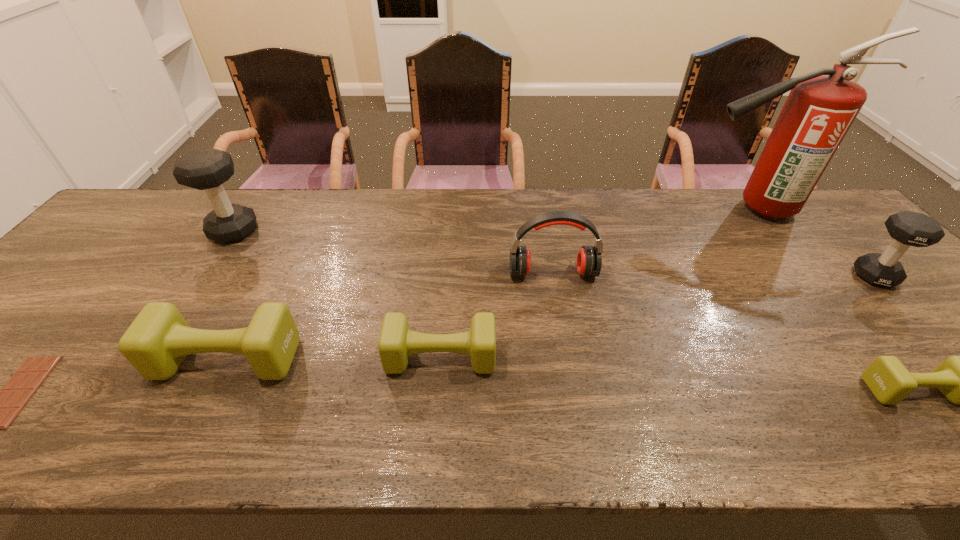
Where is `the closest olive dumbbell to the chocolate bar`? The width and height of the screenshot is (960, 540). the closest olive dumbbell to the chocolate bar is located at coordinates (156, 343).

Choose which olive dumbbell is the second nearest neighbor to the fourth dumbbell from left to right. Please provide its 2D coordinates. Your answer should be formatted as a tuple, i.e. [(x, y)], where the tuple contains the x and y coordinates of a point satisfying the conditions above.

[(156, 343)]

At what (x,y) coordinates should I click in order to perform the action: click on vacant space that satisfies the following two spatial constraints: 1. on the back side of the smaller gray dumbbell; 2. at the nozzle of the red fire extinguisher. Please return your answer as a coordinate pair (x, y). Image resolution: width=960 pixels, height=540 pixels. Looking at the image, I should click on (813, 210).

Identify the location of free point that satisfies the following two spatial constraints: 1. at the nozzle of the red fire extinguisher; 2. on the left side of the right gray dumbbell. Image resolution: width=960 pixels, height=540 pixels. (804, 276).

Find the location of a particular element. vacant space that satisfies the following two spatial constraints: 1. on the front side of the right gray dumbbell; 2. on the right side of the left gray dumbbell is located at coordinates (205, 276).

Locate an element on the screen. The height and width of the screenshot is (540, 960). blank area in the image that satisfies the following two spatial constraints: 1. at the nozzle of the fire extinguisher; 2. on the front side of the third dumbbell from left to right is located at coordinates (866, 357).

Find the location of `blank space that satisfies the following two spatial constraints: 1. at the nozzle of the red fire extinguisher; 2. on the ear cups of the earphone`. blank space that satisfies the following two spatial constraints: 1. at the nozzle of the red fire extinguisher; 2. on the ear cups of the earphone is located at coordinates (802, 273).